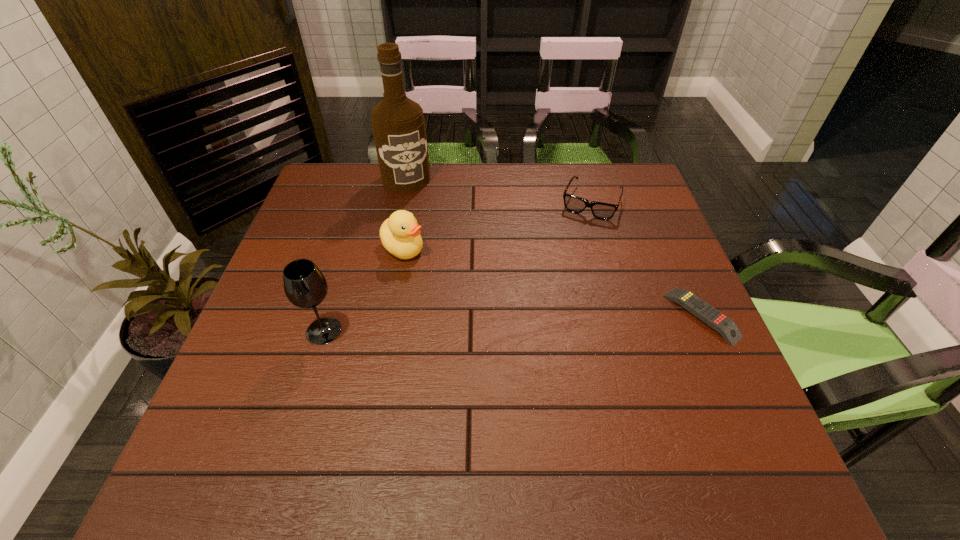
Identify the location of sunglasses situated at the far edge. Image resolution: width=960 pixels, height=540 pixels. (604, 211).

This screenshot has height=540, width=960. Identify the location of object that is at the left edge. (305, 286).

I want to click on remote control present at the right edge, so click(705, 312).

Locate an element on the screen. sunglasses at the right edge is located at coordinates (604, 211).

Identify the location of object positioned at the far right corner. The width and height of the screenshot is (960, 540). (604, 211).

Identify the location of vacant region at the far edge of the desktop. (539, 207).

Find the location of `vacant area at the near edge`. vacant area at the near edge is located at coordinates (444, 400).

This screenshot has width=960, height=540. Find the location of `vacant space at the left edge of the desktop`. vacant space at the left edge of the desktop is located at coordinates (342, 221).

Identify the location of vacant space at the right edge. The image size is (960, 540). (669, 255).

The height and width of the screenshot is (540, 960). In the image, there is a desktop. Identify the location of vacant space at the far left corner. click(353, 193).